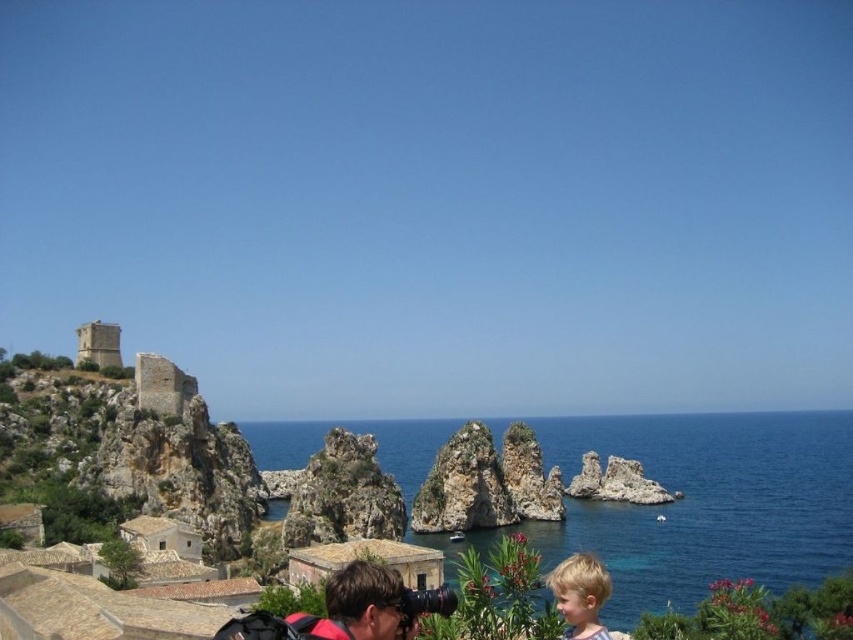
Question: Based on their relative distances, which object is nearer to the rugged stone rock formation at center?

Choices:
 (A) matte black camera at lower center
 (B) blue water at center
 (C) blonde hair at lower right

Answer: (C)

Question: Where is blue water at center located in relation to blonde hair at lower right in the image?

Choices:
 (A) below
 (B) above

Answer: (A)

Question: Which point is closer to the camera?

Choices:
 (A) matte black camera at lower center
 (B) rugged stone rock formation at center
 (C) blonde hair at lower right
 (D) blue water at center

Answer: (A)

Question: Observing the image, what is the correct spatial positioning of blue water at center in reference to blonde hair at lower right?

Choices:
 (A) left
 (B) right

Answer: (B)

Question: Can you confirm if matte black camera at lower center is positioned above blonde hair at lower right?

Choices:
 (A) yes
 (B) no

Answer: (A)

Question: Which of the following is the farthest from the observer?

Choices:
 (A) blue water at center
 (B) rugged stone rock formation at center
 (C) blonde hair at lower right
 (D) matte black camera at lower center

Answer: (B)